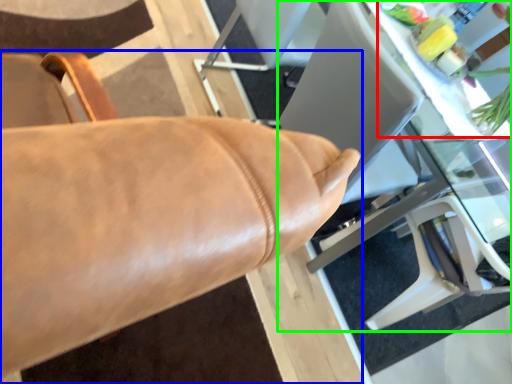
Question: Which object is the closest to the floral arrangement (highlighted by a red box)? Choose among these: chair (highlighted by a blue box) or table (highlighted by a green box).

Choices:
 (A) chair
 (B) table

Answer: (B)